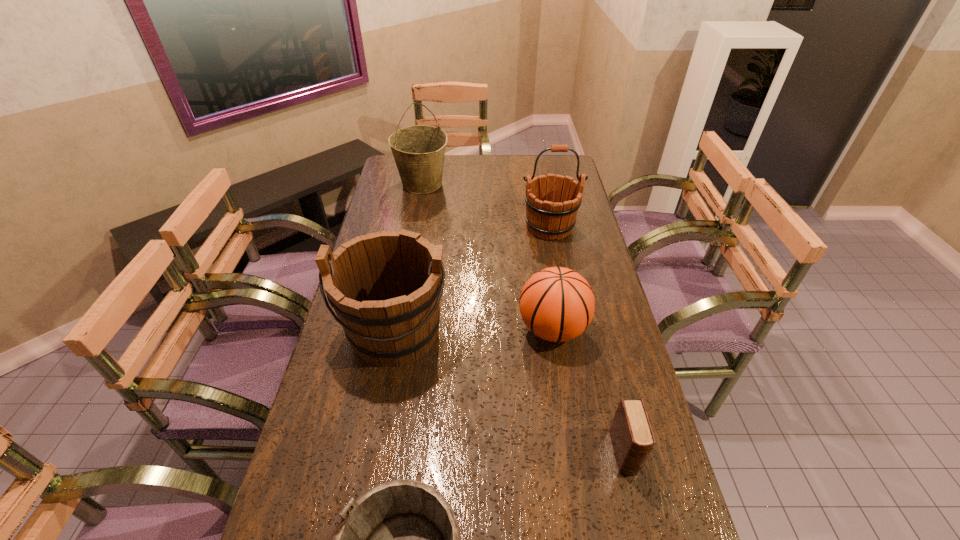
In order to click on object at the far edge in this screenshot , I will do pos(419,150).

Identify the location of wine bucket present at the right edge. This screenshot has height=540, width=960. (546, 216).

Locate an element on the screen. Image resolution: width=960 pixels, height=540 pixels. basketball at the right edge is located at coordinates (557, 304).

The image size is (960, 540). I want to click on diary positioned at the right edge, so click(x=632, y=437).

Image resolution: width=960 pixels, height=540 pixels. I want to click on object positioned at the far left corner, so click(x=419, y=150).

You are a GUI agent. You are given a task and a screenshot of the screen. Output one action in this format:
    pyautogui.click(x=<x>, y=<y>)
    Task: Click on the vacant area at the far edge of the desktop
    
    Given the screenshot: What is the action you would take?
    pyautogui.click(x=523, y=154)

This screenshot has height=540, width=960. Find the location of `free space at the left edge`. free space at the left edge is located at coordinates (351, 433).

The height and width of the screenshot is (540, 960). In the image, there is a desktop. What are the coordinates of `vacant space at the right edge` in the screenshot? It's located at pyautogui.click(x=601, y=428).

What are the coordinates of `empty location between the third farthest wine bucket and the second farthest object` in the screenshot? It's located at (472, 279).

Image resolution: width=960 pixels, height=540 pixels. In order to click on free spot between the second nearest wine bucket and the third shortest object in this screenshot , I will do `click(474, 330)`.